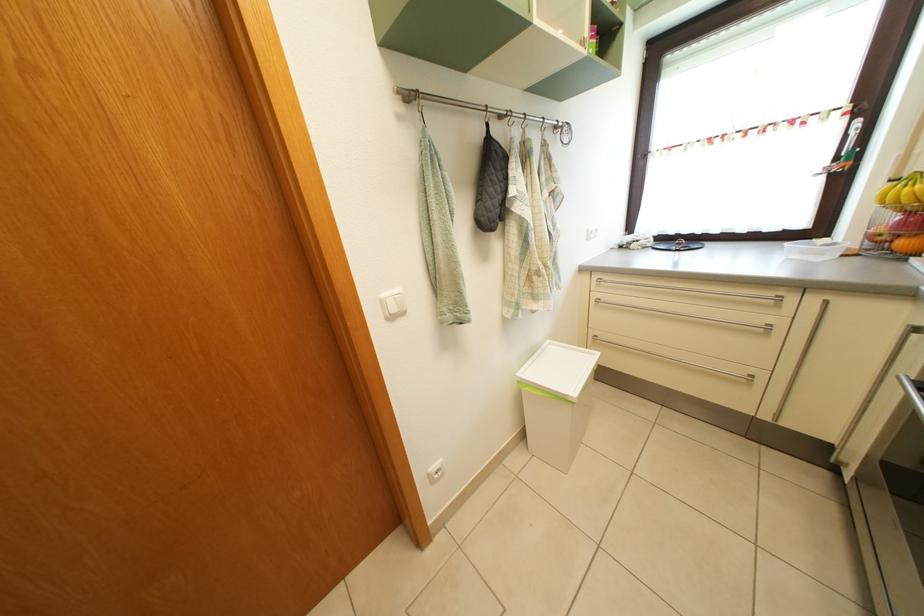
What are the coordinates of `metal cabinet handle` in the screenshot? It's located at (687, 315).